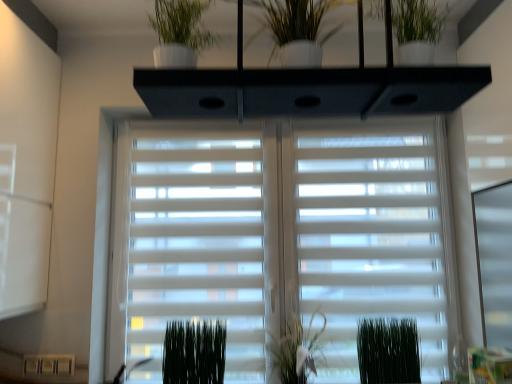
Question: Is green matte plant at center, which appears as the 2th plant when viewed from the left, not close to green matte plant at lower center, which is counted as the 3th plant, starting from the right?

Choices:
 (A) no
 (B) yes

Answer: (A)

Question: Does green matte plant at center, which appears as the 2th plant when viewed from the left, turn towards green matte plant at lower center, which is counted as the 3th plant, starting from the right?

Choices:
 (A) no
 (B) yes

Answer: (A)

Question: Can you confirm if green matte plant at center, marked as the second plant in a right-to-left arrangement, is bigger than green matte plant at lower center, which is counted as the 3th plant, starting from the right?

Choices:
 (A) yes
 (B) no

Answer: (A)

Question: Is green matte plant at center, which appears as the 2th plant when viewed from the left, facing away from green matte plant at lower center, which is counted as the 1th plant, starting from the left?

Choices:
 (A) yes
 (B) no

Answer: (B)

Question: Does green matte plant at center, which appears as the 2th plant when viewed from the left, have a greater width compared to green matte plant at lower center, which is counted as the 3th plant, starting from the right?

Choices:
 (A) yes
 (B) no

Answer: (A)

Question: Considering the relative sizes of green matte plant at center, marked as the second plant in a right-to-left arrangement, and green matte plant at lower center, which is counted as the 3th plant, starting from the right, in the image provided, is green matte plant at center, marked as the second plant in a right-to-left arrangement, smaller than green matte plant at lower center, which is counted as the 3th plant, starting from the right,?

Choices:
 (A) yes
 (B) no

Answer: (B)

Question: Is white matte window blind at center not within white glossy vase at upper center?

Choices:
 (A) yes
 (B) no

Answer: (A)

Question: Does white matte window blind at center have a lesser width compared to white glossy vase at upper center?

Choices:
 (A) yes
 (B) no

Answer: (A)

Question: Could white glossy vase at upper center be considered to be inside white matte window blind at center?

Choices:
 (A) yes
 (B) no

Answer: (B)

Question: Considering the relative sizes of white matte window blind at center and white glossy vase at upper center in the image provided, is white matte window blind at center wider than white glossy vase at upper center?

Choices:
 (A) yes
 (B) no

Answer: (B)

Question: Is white matte window blind at center positioned with its back to white glossy vase at upper center?

Choices:
 (A) no
 (B) yes

Answer: (A)

Question: From the image's perspective, is white matte window blind at center on top of white glossy vase at upper center?

Choices:
 (A) no
 (B) yes

Answer: (A)

Question: Can you confirm if green matte plant at lower right, the third plant positioned from the left, is thinner than white glossy vase at upper center?

Choices:
 (A) no
 (B) yes

Answer: (B)